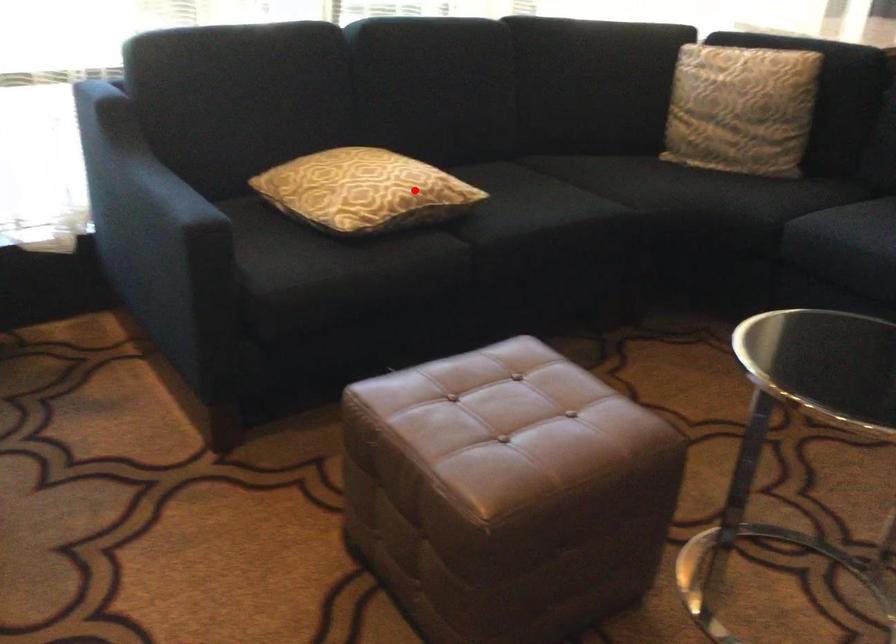
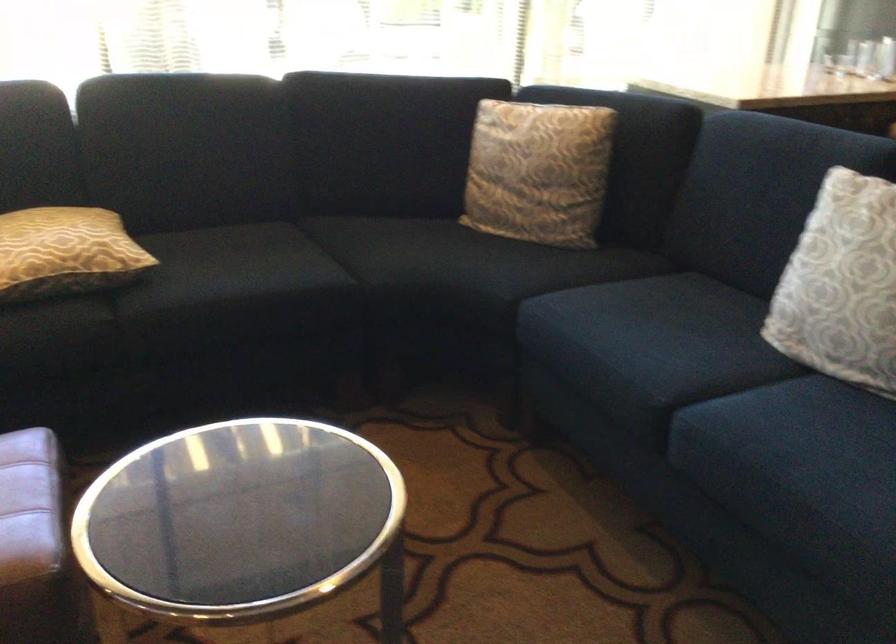
Find the pixel in the second image that matches the highlighted location in the first image.

(65, 252)